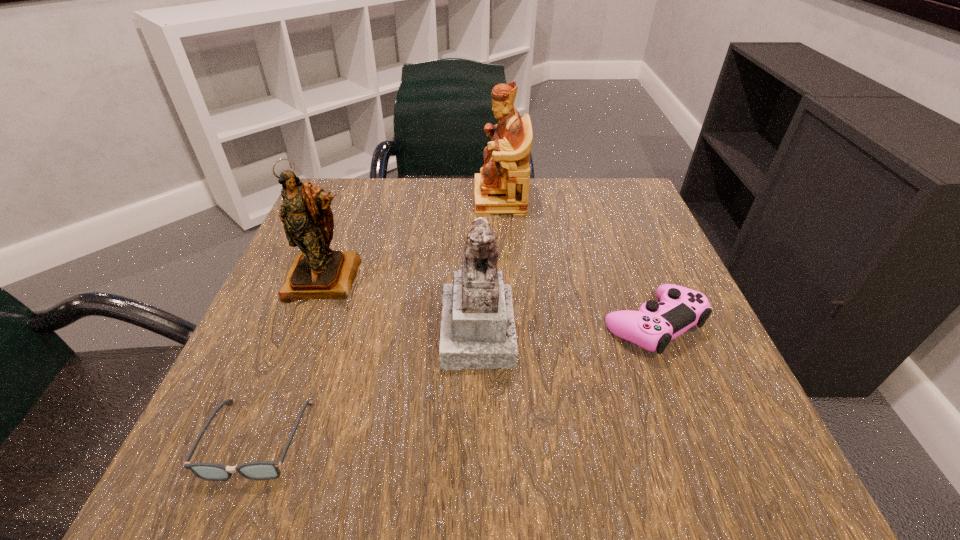
Where is `the second closest figurine relative to the farthest object`? the second closest figurine relative to the farthest object is located at coordinates (477, 331).

This screenshot has height=540, width=960. Identify the location of free space that satisfies the following two spatial constraints: 1. on the front-facing side of the leftmost figurine; 2. on the right side of the rightmost object. (307, 325).

Where is `free spot that satisfies the following two spatial constraints: 1. on the front-facing side of the farthest figurine; 2. on the back side of the control`? This screenshot has height=540, width=960. free spot that satisfies the following two spatial constraints: 1. on the front-facing side of the farthest figurine; 2. on the back side of the control is located at coordinates pos(508,325).

Identify the location of free space that satisfies the following two spatial constraints: 1. on the front-facing side of the farthest figurine; 2. on the face of the nearest object. This screenshot has width=960, height=540. (515, 440).

Locate an element on the screen. free space that satisfies the following two spatial constraints: 1. on the front-facing side of the farthest object; 2. on the front-facing side of the leftmost figurine is located at coordinates (505, 278).

You are a GUI agent. You are given a task and a screenshot of the screen. Output one action in this format:
    pyautogui.click(x=<x>, y=<y>)
    Task: Click on the vacant space that satisfies the following two spatial constraints: 1. on the front-facing side of the leftmost figurine; 2. on the left side of the control
    This screenshot has height=540, width=960.
    Given the screenshot: What is the action you would take?
    pyautogui.click(x=307, y=325)

Locate an element on the screen. free location that satisfies the following two spatial constraints: 1. on the front-facing side of the farthest object; 2. on the back side of the control is located at coordinates (508, 325).

Where is `free spot that satisfies the following two spatial constraints: 1. on the front-facing side of the farthest figurine; 2. on the front-facing side of the leftmost figurine`? This screenshot has width=960, height=540. free spot that satisfies the following two spatial constraints: 1. on the front-facing side of the farthest figurine; 2. on the front-facing side of the leftmost figurine is located at coordinates (505, 278).

Identify the location of vacant space that satisfies the following two spatial constraints: 1. on the front-facing side of the farthest object; 2. on the face of the nearest object. The image size is (960, 540). (515, 440).

Find the location of a particular element. The height and width of the screenshot is (540, 960). vacant space that satisfies the following two spatial constraints: 1. on the front-facing side of the farthest figurine; 2. on the face of the spectacles is located at coordinates (515, 440).